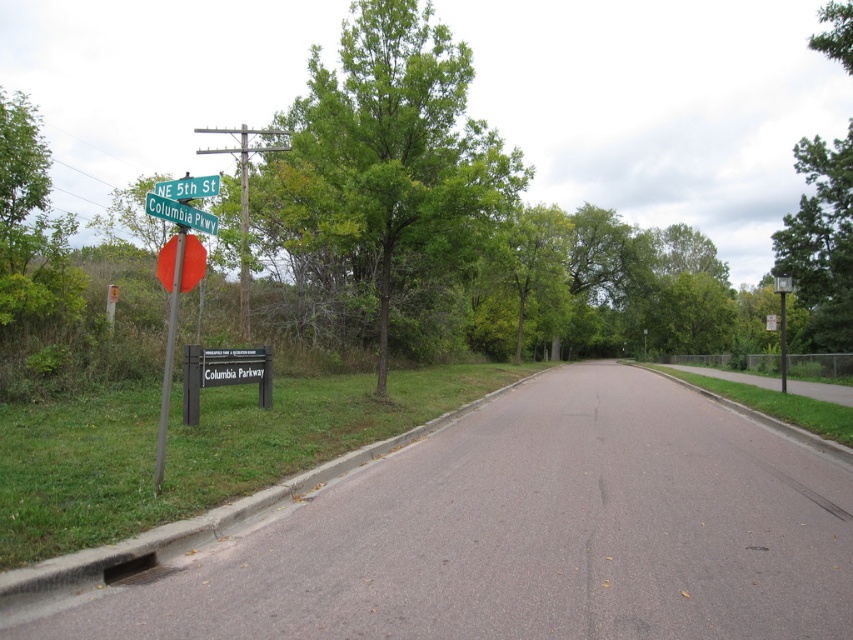
You are a delivery driver planning to turn left onto NE 5th St. You see the green leafy tree at upper right and the green metallic street sign at upper left. Which object is wider from your perspective?

The green leafy tree at upper right might be wider than the green metallic street sign at upper left according to the description.

You are a pedestrian standing at the intersection and want to read the black metal sign at lower left. Can you see it clearly without moving from your current position, considering the metallic pole at left might block your view?

The black metal sign at lower left is positioned under the metallic pole at left, so it is likely partially or fully obscured by the pole, making it difficult to see clearly without moving.

You are driving a car and see the green leafy tree at upper right and the green metallic street sign at upper left in your view. Which object is closer to you?

The green leafy tree at upper right is closer to you because the green metallic street sign at upper left is behind it.